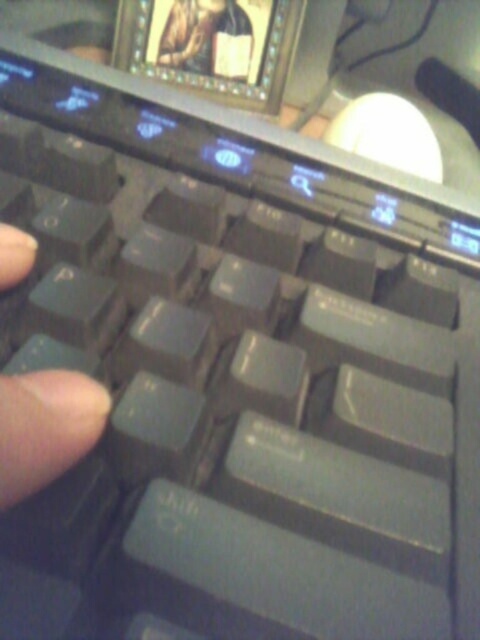
Question: Among these objects, which one is farthest from the camera?

Choices:
 (A) white glossy mouse at upper center
 (B) wooden carved statue at upper center

Answer: (B)

Question: Can you confirm if flesh-toned skin at center is thinner than white glossy mouse at upper center?

Choices:
 (A) yes
 (B) no

Answer: (A)

Question: Is flesh-toned skin at center below white glossy mouse at upper center?

Choices:
 (A) no
 (B) yes

Answer: (B)

Question: Which object is positioned closest to the flesh-toned skin at center?

Choices:
 (A) wooden carved statue at upper center
 (B) white glossy mouse at upper center

Answer: (B)

Question: Is white glossy mouse at upper center in front of wooden carved statue at upper center?

Choices:
 (A) no
 (B) yes

Answer: (B)

Question: Which point appears farthest from the camera in this image?

Choices:
 (A) click(x=46, y=400)
 (B) click(x=182, y=67)
 (C) click(x=416, y=150)

Answer: (B)